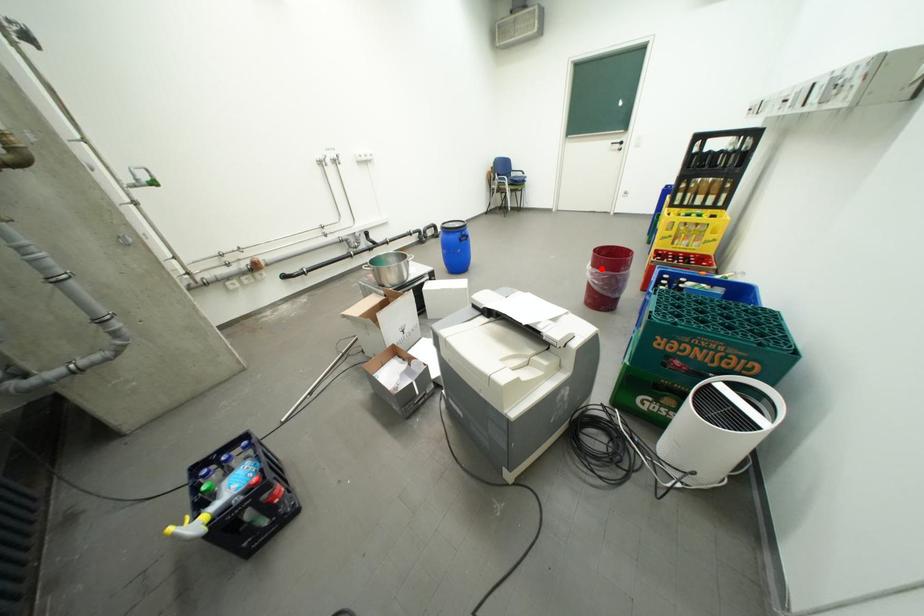
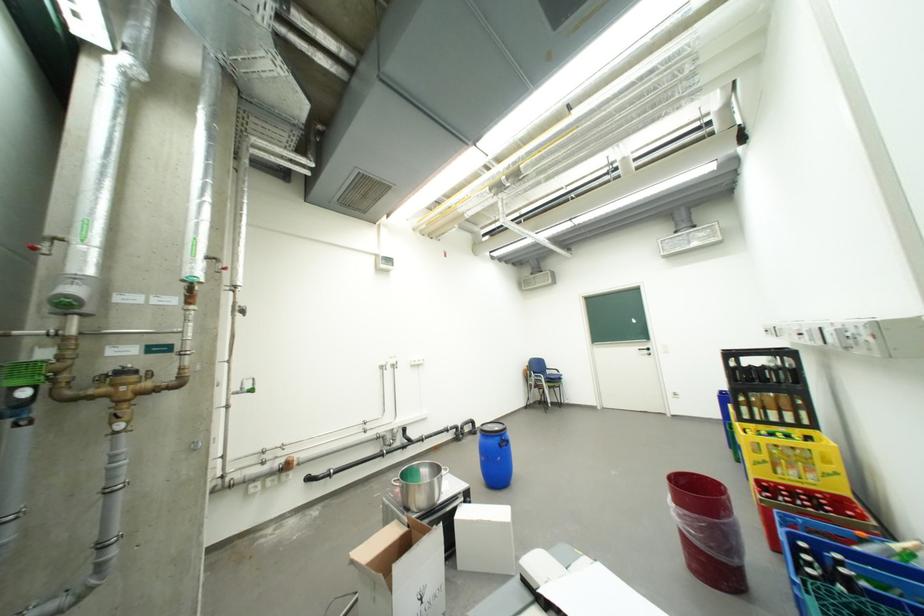
Question: I am providing you with two images of the same scene from different viewpoints. Image1 has a red point marked. In image2, the corresponding 3D location appears at what relative position? Reply with the corresponding letter.

Choices:
 (A) Closer
 (B) Farther

Answer: (B)